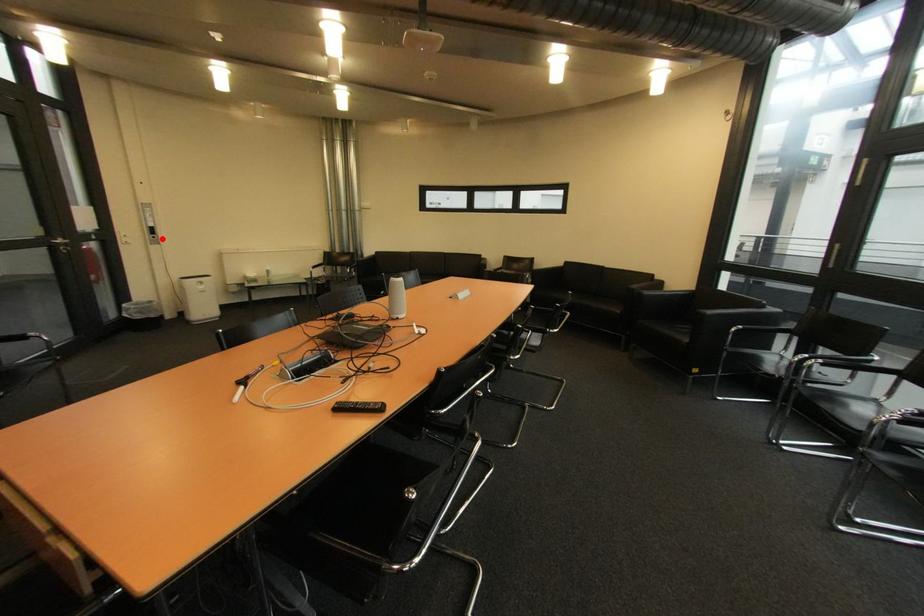
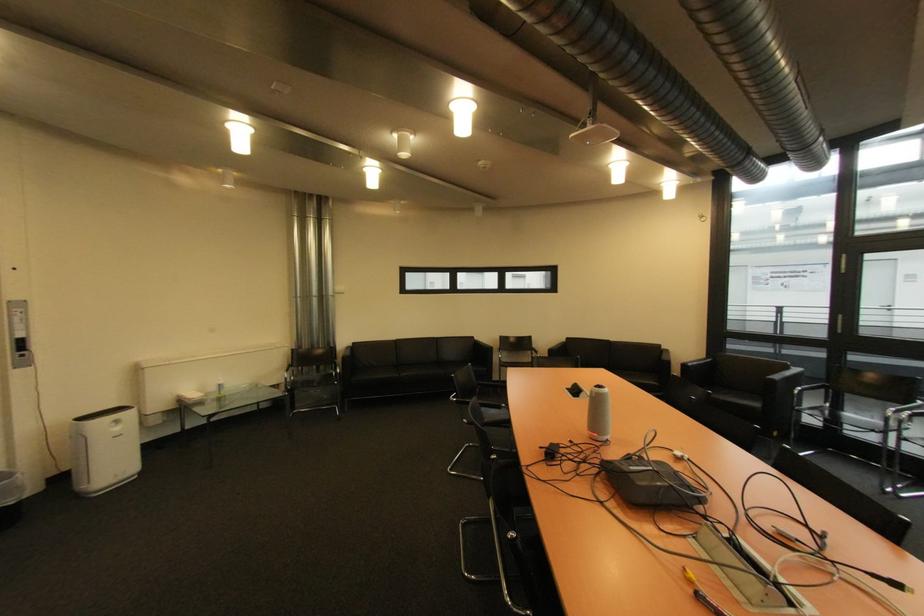
Find the pixel in the second image that matches the highlighted location in the first image.

(30, 357)